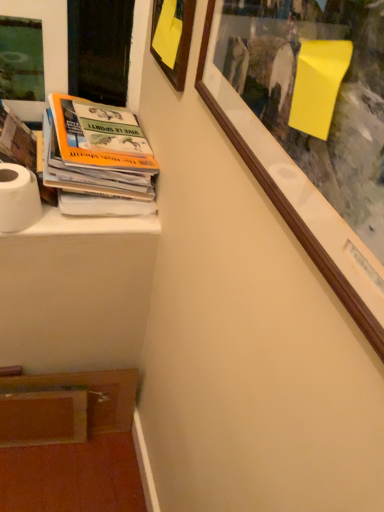
Question: Considering the positions of wooden picture frame at upper left, the 1th picture frame in the left-to-right sequence, and white paper stack at left in the image, is wooden picture frame at upper left, the 1th picture frame in the left-to-right sequence, wider or thinner than white paper stack at left?

Choices:
 (A) wide
 (B) thin

Answer: (B)

Question: Considering the positions of wooden picture frame at upper left, the 1th picture frame in the left-to-right sequence, and white paper stack at left in the image, is wooden picture frame at upper left, the 1th picture frame in the left-to-right sequence, taller or shorter than white paper stack at left?

Choices:
 (A) tall
 (B) short

Answer: (A)

Question: Considering the real-world distances, which object is farthest from the white paper stack at left?

Choices:
 (A) wooden picture frame at upper center, the first picture frame in the right-to-left sequence
 (B) wooden picture frame at upper left, the 1th picture frame in the left-to-right sequence
 (C) white matte toilet paper at lower left

Answer: (A)

Question: Which is nearer to the wooden picture frame at upper center, which appears as the second picture frame when viewed from the left?

Choices:
 (A) white matte toilet paper at lower left
 (B) white paper stack at left
 (C) wooden picture frame at upper left, the 1th picture frame in the left-to-right sequence

Answer: (B)